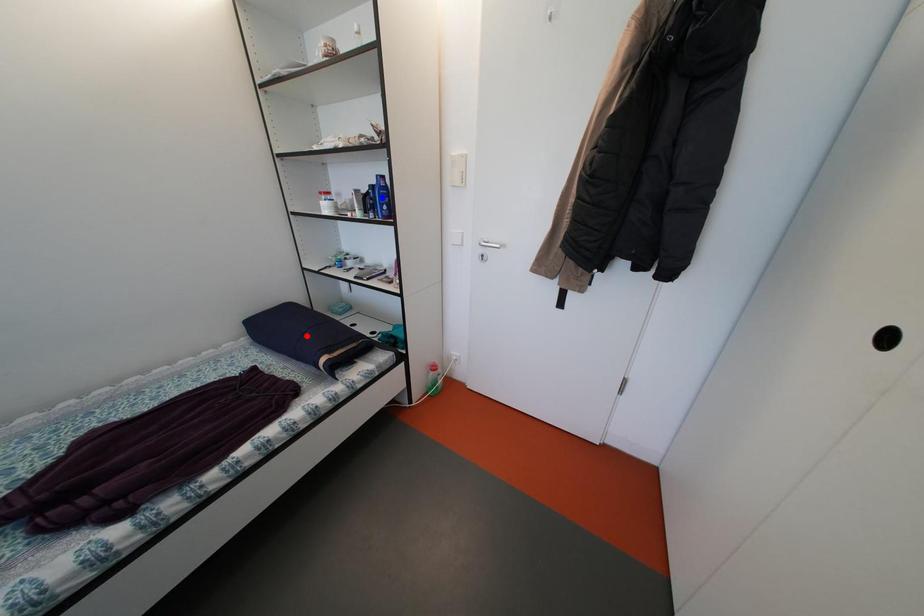
Question: Which of the two points in the image is closer to the camera?

Choices:
 (A) Blue point is closer.
 (B) Red point is closer.

Answer: (A)